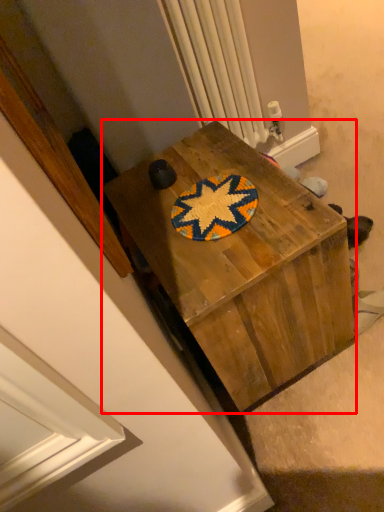
Question: Observing the image, what is the correct spatial positioning of desk (annotated by the red box) in reference to radiator?

Choices:
 (A) right
 (B) left

Answer: (B)